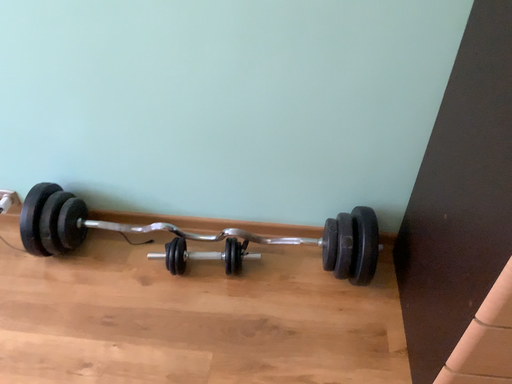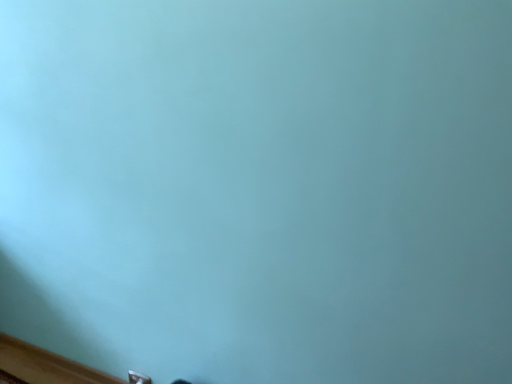
Question: How did the camera likely rotate when shooting the video?

Choices:
 (A) rotated right
 (B) rotated left

Answer: (B)